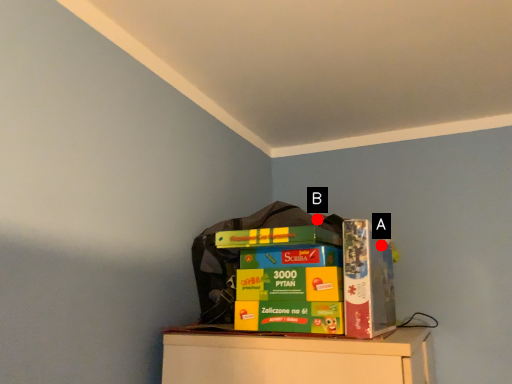
Question: Two points are circled on the image, labeled by A and B beside each circle. Among these points, which one is nearest to the camera?

Choices:
 (A) A is closer
 (B) B is closer

Answer: (A)